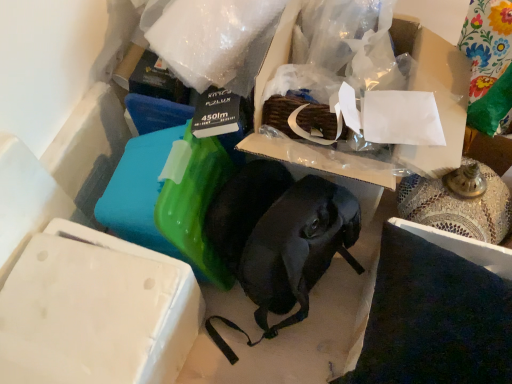
Question: From the image's perspective, is matte cardboard box at center located beneath white matte box at lower left?

Choices:
 (A) no
 (B) yes

Answer: (A)

Question: From a real-world perspective, does matte cardboard box at center stand above white matte box at lower left?

Choices:
 (A) yes
 (B) no

Answer: (A)

Question: Is white matte box at lower left a part of matte cardboard box at center?

Choices:
 (A) yes
 (B) no

Answer: (B)

Question: Can we say matte cardboard box at center lies outside white matte box at lower left?

Choices:
 (A) no
 (B) yes

Answer: (B)

Question: Is matte cardboard box at center thinner than white matte box at lower left?

Choices:
 (A) no
 (B) yes

Answer: (A)

Question: From the image's perspective, is matte cardboard box at center above white matte box at lower left?

Choices:
 (A) yes
 (B) no

Answer: (A)

Question: Would you say white matte box at lower left is outside matte cardboard box at center?

Choices:
 (A) no
 (B) yes

Answer: (B)

Question: From a real-world perspective, is white matte box at lower left positioned over matte cardboard box at center based on gravity?

Choices:
 (A) no
 (B) yes

Answer: (A)

Question: Could matte cardboard box at center be considered to be inside white matte box at lower left?

Choices:
 (A) no
 (B) yes

Answer: (A)

Question: From a real-world perspective, is white matte box at lower left beneath matte cardboard box at center?

Choices:
 (A) no
 (B) yes

Answer: (B)

Question: Can you confirm if white matte box at lower left is wider than matte cardboard box at center?

Choices:
 (A) yes
 (B) no

Answer: (B)

Question: Can you confirm if white matte box at lower left is shorter than matte cardboard box at center?

Choices:
 (A) yes
 (B) no

Answer: (A)

Question: In terms of size, does matte cardboard box at center appear bigger or smaller than white matte box at lower left?

Choices:
 (A) small
 (B) big

Answer: (B)